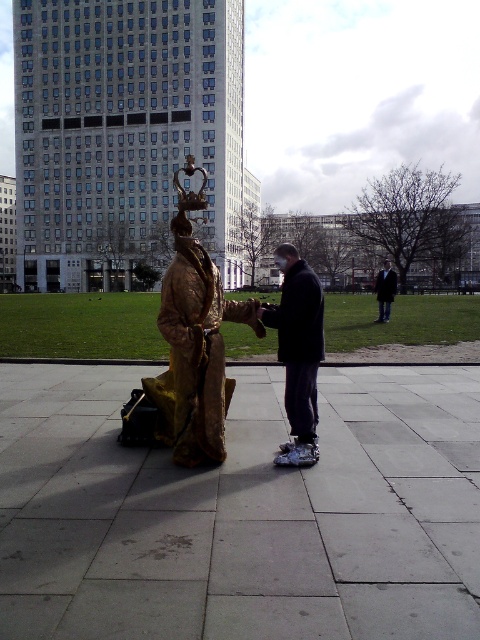
Can you confirm if metallic gold statue at center is wider than dark brown leather jacket at center?

No, metallic gold statue at center is not wider than dark brown leather jacket at center.

Which is behind, point (309, 314) or point (391, 269)?

The point (391, 269) is behind.

What do you see at coordinates (298, 352) in the screenshot?
I see `metallic gold statue at center` at bounding box center [298, 352].

You are a GUI agent. You are given a task and a screenshot of the screen. Output one action in this format:
    pyautogui.click(x=<x>, y=<y>)
    Task: Click on the metallic gold statue at center
    
    Given the screenshot: What is the action you would take?
    pyautogui.click(x=298, y=352)

Does bronze statue at center have a smaller size compared to dark brown leather jacket at center?

No.

Who is lower down, bronze statue at center or dark brown leather jacket at center?

Positioned lower is dark brown leather jacket at center.

Identify the location of bronze statue at center. Image resolution: width=480 pixels, height=640 pixels. (193, 342).

Between bronze statue at center and metallic gold statue at center, which one is positioned lower?

metallic gold statue at center is lower down.

Can you confirm if bronze statue at center is bigger than metallic gold statue at center?

Correct, bronze statue at center is larger in size than metallic gold statue at center.

Between point (193, 349) and point (314, 360), which one is positioned behind?

The point (314, 360) is more distant.

Locate an element on the screen. bronze statue at center is located at coordinates coord(193,342).